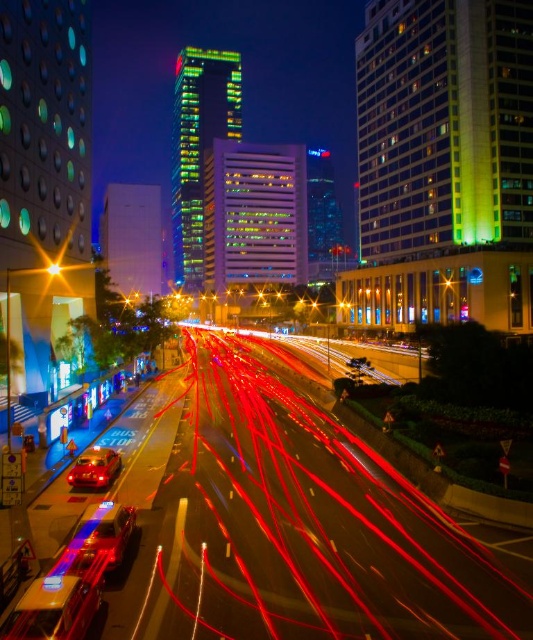
Question: Does metallic silver car at center have a greater width compared to shiny red car at center?

Choices:
 (A) yes
 (B) no

Answer: (A)

Question: Can you confirm if metallic silver car at center is positioned to the right of bright yellow light at center?

Choices:
 (A) no
 (B) yes

Answer: (B)

Question: Based on their relative distances, which object is farther from the bright yellow light at center?

Choices:
 (A) metallic silver car at center
 (B) shiny red car at center

Answer: (A)

Question: Does metallic silver car at center appear on the right side of bright yellow light at center?

Choices:
 (A) yes
 (B) no

Answer: (A)

Question: Which point is farther to the camera?

Choices:
 (A) shiny red car at center
 (B) metallic silver car at center
 (C) bright yellow light at center

Answer: (C)

Question: Estimate the real-world distances between objects in this image. Which object is closer to the shiny red car at center?

Choices:
 (A) metallic silver car at center
 (B) bright yellow light at center

Answer: (A)